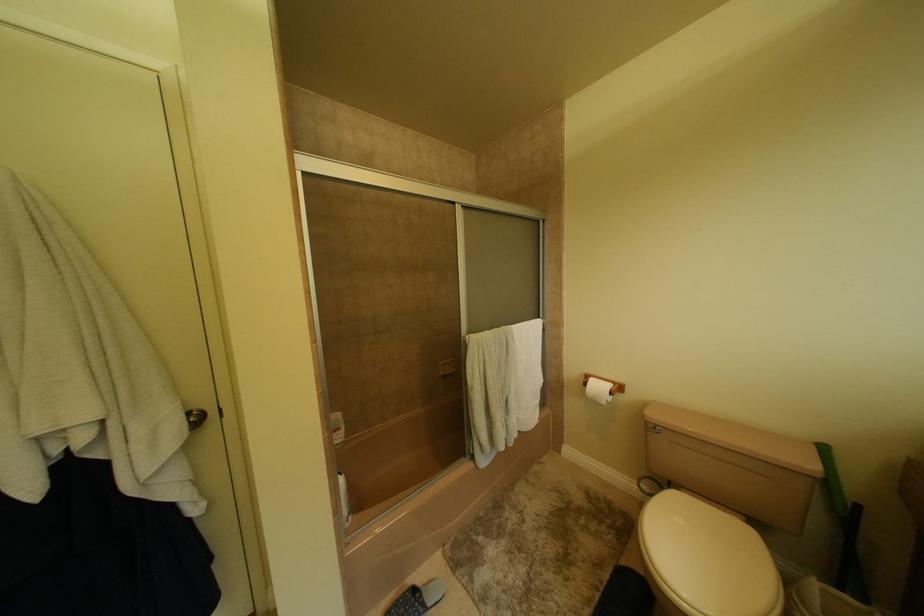
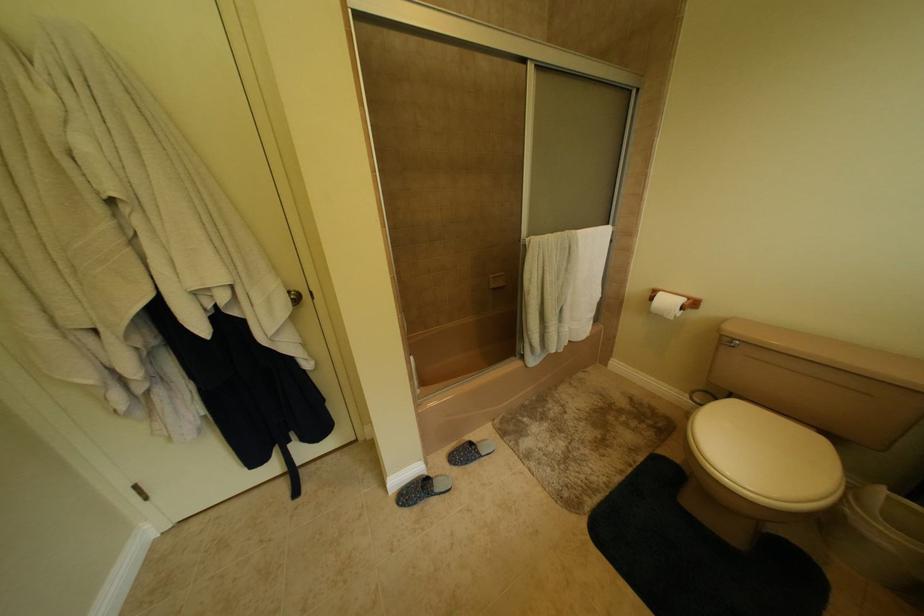
Question: The images are taken continuously from a first-person perspective. In which direction is your viewpoint rotating?

Choices:
 (A) Left
 (B) Right
 (C) Up
 (D) Down

Answer: (D)